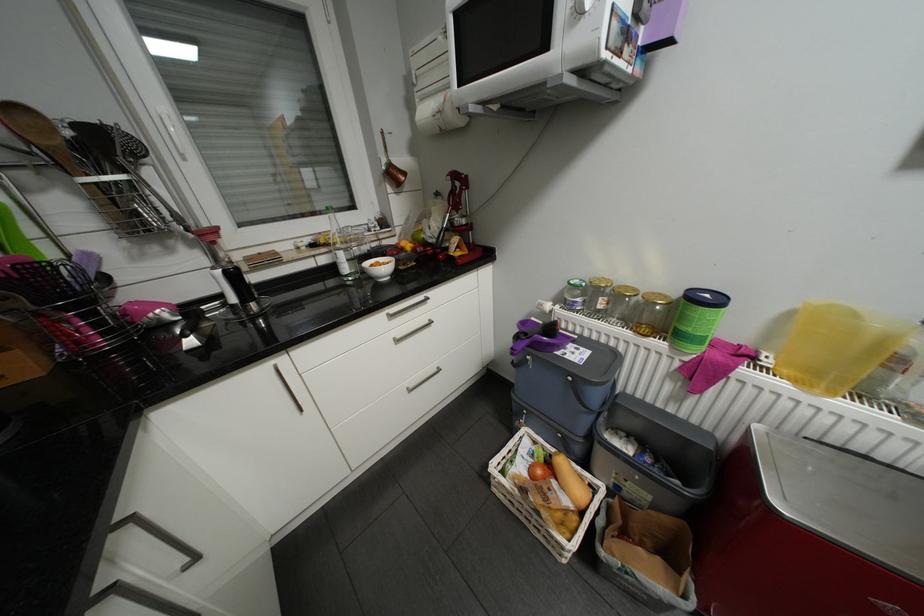
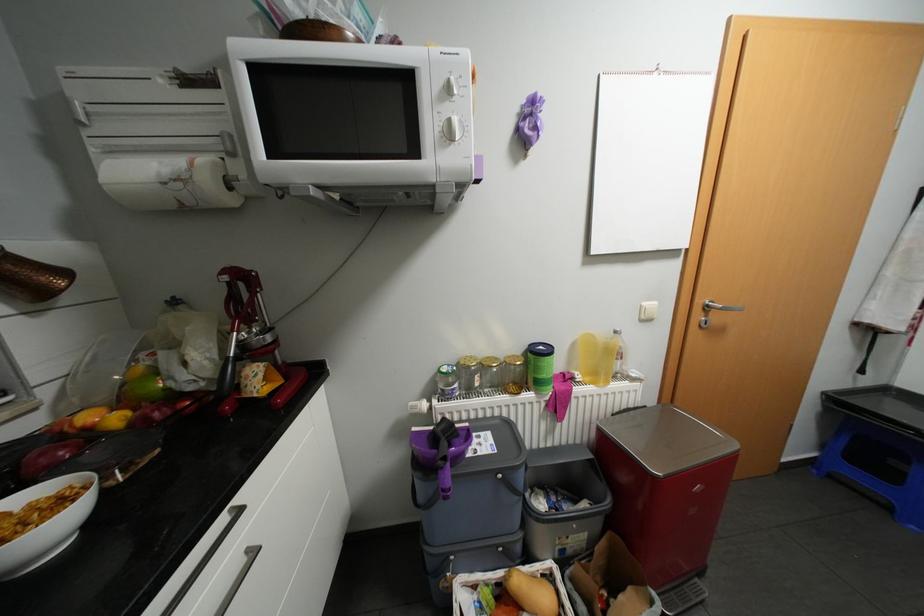
Where in the second image is the point corresponding to (x=469, y=120) from the first image?

(239, 199)